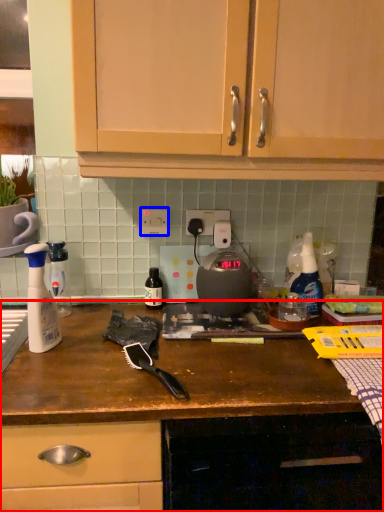
Question: Which object appears closest to the camera in this image, cabinetry (highlighted by a red box) or electric outlet (highlighted by a blue box)?

Choices:
 (A) cabinetry
 (B) electric outlet

Answer: (A)